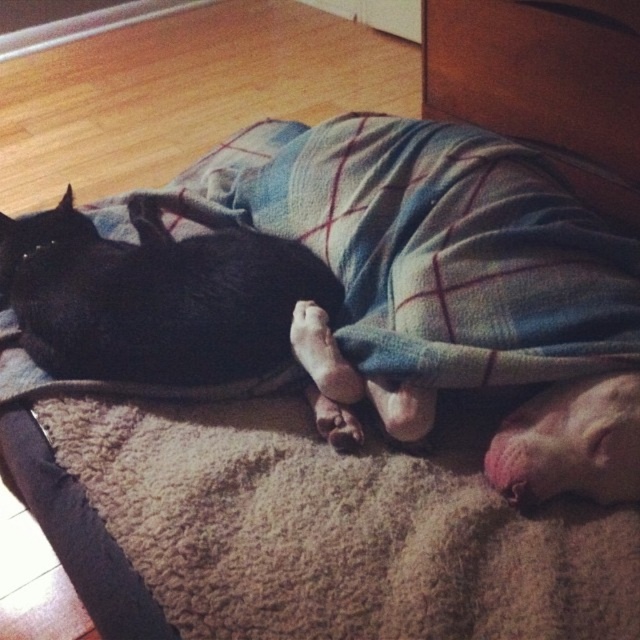
What do you see at coordinates (156, 296) in the screenshot? The height and width of the screenshot is (640, 640). I see `black fur cat at left` at bounding box center [156, 296].

Does black fur cat at left have a larger size compared to wooden drawer at upper center?

No.

You are a GUI agent. You are given a task and a screenshot of the screen. Output one action in this format:
    pyautogui.click(x=<x>, y=<y>)
    Task: Click on the black fur cat at left
    
    Given the screenshot: What is the action you would take?
    pyautogui.click(x=156, y=296)

Identify the location of black fur cat at left. (156, 296).

Does point (257, 388) come closer to viewer compared to point (157, 298)?

No, it is not.

Does plaid fabric blanket at center have a greater width compared to black fur cat at left?

Yes, plaid fabric blanket at center is wider than black fur cat at left.

What are the coordinates of `plaid fabric blanket at center` in the screenshot? It's located at (436, 246).

I want to click on plaid fabric blanket at center, so click(x=436, y=246).

Is point (244, 147) closer to camera compared to point (611, 36)?

No, it is not.

Is the position of plaid fabric blanket at center less distant than that of wooden drawer at upper center?

Yes, it is.

The image size is (640, 640). What do you see at coordinates (436, 246) in the screenshot? I see `plaid fabric blanket at center` at bounding box center [436, 246].

Identify the location of plaid fabric blanket at center. (436, 246).